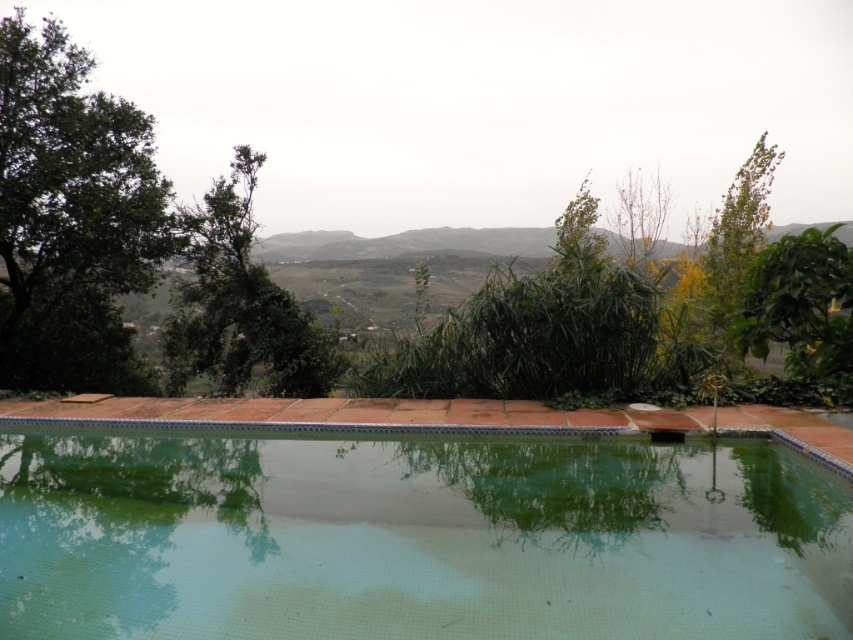
Question: Does green tile swimming pool at center come behind green leafy tree at left?

Choices:
 (A) yes
 (B) no

Answer: (B)

Question: Estimate the real-world distances between objects in this image. Which object is closer to the green leafy tree at upper left?

Choices:
 (A) green leafy tree at upper right
 (B) yellow-green leafy tree at upper right
 (C) green leafy tree at left
 (D) green tile swimming pool at center

Answer: (C)

Question: Which point is farther from the camera taking this photo?

Choices:
 (A) (767, 173)
 (B) (224, 598)

Answer: (A)

Question: Is green leafy tree at left above yellow-green leafy tree at upper right?

Choices:
 (A) yes
 (B) no

Answer: (B)

Question: Is green leafy tree at upper left further to the viewer compared to green leafy tree at upper right?

Choices:
 (A) no
 (B) yes

Answer: (B)

Question: Which point appears closest to the camera in this image?

Choices:
 (A) (810, 296)
 (B) (746, 230)
 (C) (318, 497)

Answer: (C)